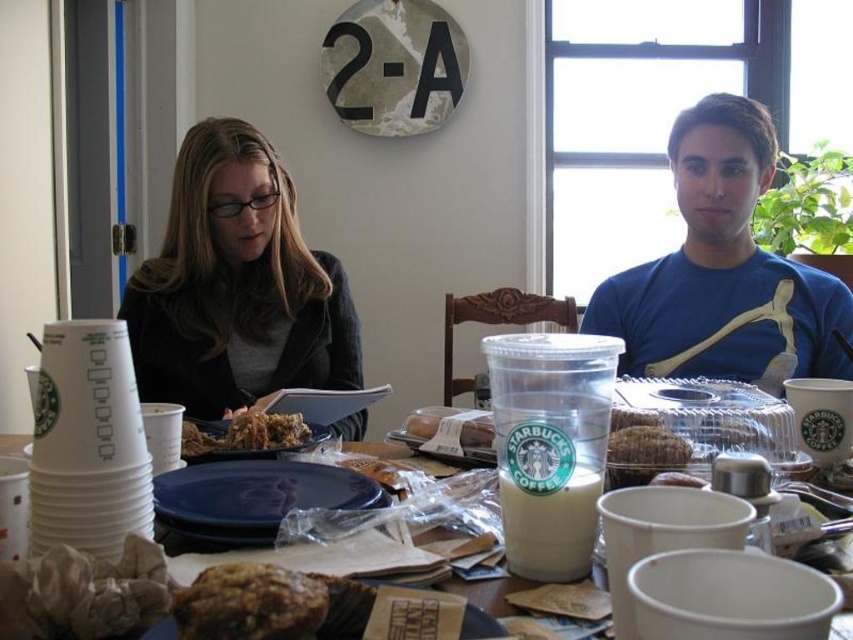
Does brown crumbly pastry at center appear under brown crumbly cake at center?

Yes, brown crumbly pastry at center is below brown crumbly cake at center.

Which is in front, point (222, 628) or point (650, 470)?

Point (222, 628) is in front.

Who is more forward, (312, 579) or (627, 470)?

Point (312, 579) is more forward.

At what (x,y) coordinates should I click in order to perform the action: click on brown crumbly pastry at center. Please return your answer as a coordinate pair (x, y). Looking at the image, I should click on (248, 604).

This screenshot has height=640, width=853. I want to click on brown crumbly pastry at center, so click(x=248, y=604).

Does brown crumbly pastry at center have a smaller size compared to white paper cups at center?

Indeed, brown crumbly pastry at center has a smaller size compared to white paper cups at center.

Image resolution: width=853 pixels, height=640 pixels. Find the location of `brown crumbly pastry at center`. brown crumbly pastry at center is located at coordinates (248, 604).

This screenshot has height=640, width=853. Describe the element at coordinates (550, 528) in the screenshot. I see `white opaque cup at center` at that location.

Who is positioned more to the left, white opaque cup at center or brown crumbly cake at center?

Positioned to the left is white opaque cup at center.

Is point (589, 552) farther from camera compared to point (653, 432)?

No, (589, 552) is closer to viewer.

This screenshot has width=853, height=640. What are the coordinates of `white opaque cup at center` in the screenshot? It's located at (550, 528).